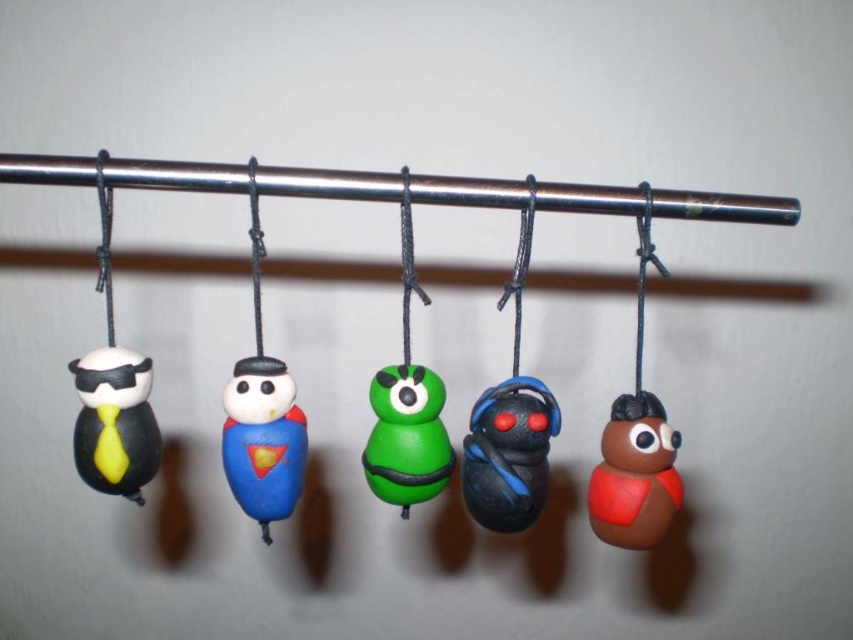
Is matte black beetle at center thinner than brown matte/soft toy at center-right?

No, matte black beetle at center is not thinner than brown matte/soft toy at center-right.

Can you confirm if matte black beetle at center is positioned to the left of brown matte/soft toy at center-right?

Yes, matte black beetle at center is to the left of brown matte/soft toy at center-right.

Between point (546, 436) and point (654, 419), which one is positioned in front?

Point (546, 436)

Identify the location of matte black beetle at center. (508, 452).

Is point (254, 468) farther from viewer compared to point (404, 378)?

No.

Who is shorter, blue matte/satin superman figure at center or green matte toy at center?

green matte toy at center is shorter.

Who is more forward, [292,499] or [387,387]?

Point [387,387] is more forward.

Locate an element on the screen. The width and height of the screenshot is (853, 640). blue matte/satin superman figure at center is located at coordinates (263, 440).

Is blue matte/satin superman figure at center taller than brown matte/soft toy at center-right?

Correct, blue matte/satin superman figure at center is much taller as brown matte/soft toy at center-right.

Consider the image. Can you confirm if blue matte/satin superman figure at center is thinner than brown matte/soft toy at center-right?

Yes.

Between point (280, 474) and point (614, 497), which one is positioned behind?

Positioned behind is point (614, 497).

Locate an element on the screen. This screenshot has width=853, height=640. blue matte/satin superman figure at center is located at coordinates (263, 440).